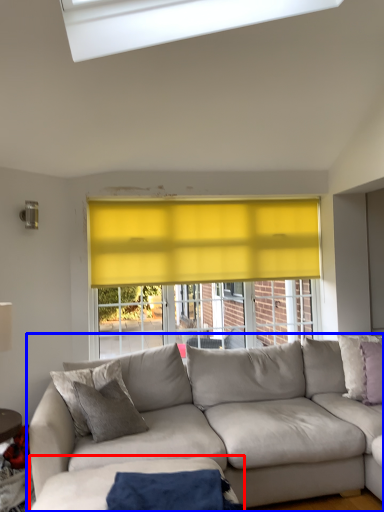
Question: Which object appears closest to the camera in this image, plain (highlighted by a red box) or studio couch (highlighted by a blue box)?

Choices:
 (A) plain
 (B) studio couch

Answer: (A)